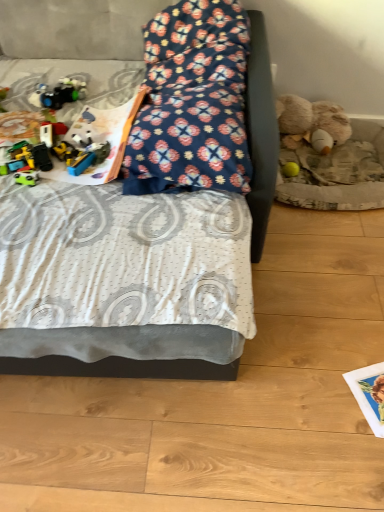
This screenshot has width=384, height=512. Describe the element at coordinates (58, 93) in the screenshot. I see `shiny plastic toy car at left, which is the third toy in right-to-left order` at that location.

Describe the element at coordinates (260, 133) in the screenshot. Image resolution: width=384 pixels, height=512 pixels. I see `floral fabric bed at center` at that location.

This screenshot has width=384, height=512. I want to click on floral fabric bed at center, so click(x=260, y=133).

Describe the element at coordinates (312, 123) in the screenshot. The height and width of the screenshot is (512, 384). I see `fluffy beige teddy bear at right` at that location.

What do you see at coordinates (26, 177) in the screenshot? I see `matte green toy car at left, which is counted as the third toy, starting from the back` at bounding box center [26, 177].

Describe the element at coordinates (192, 102) in the screenshot. I see `floral fabric pillow at center` at that location.

This screenshot has width=384, height=512. I want to click on yellow rubber ball at lower right, the third toy from the left, so click(290, 169).

Is fluffy beige teddy bear at right beside yellow rubber ball at lower right, the third toy from the left?

No, fluffy beige teddy bear at right is not touching yellow rubber ball at lower right, the third toy from the left.

Is yellow rubber ball at lower right, which is the second toy from bottom to top, at the back of fluffy beige teddy bear at right?

fluffy beige teddy bear at right does not have its back to yellow rubber ball at lower right, which is the second toy from bottom to top.

Does fluffy beige teddy bear at right have a larger size compared to yellow rubber ball at lower right, the third toy from the left?

Yes.

Considering the points (313, 143) and (284, 174), which point is behind, point (313, 143) or point (284, 174)?

Point (313, 143)

Between matte green toy car at left, which is the second toy from left to right, and yellow rubber ball at lower right, the third toy from the front, which one has more height?

Standing taller between the two is yellow rubber ball at lower right, the third toy from the front.

Considering the positions of objects matte green toy car at left, placed as the first toy when sorted from front to back, and yellow rubber ball at lower right, which is the first toy from back to front, in the image provided, who is behind, matte green toy car at left, placed as the first toy when sorted from front to back, or yellow rubber ball at lower right, which is the first toy from back to front,?

yellow rubber ball at lower right, which is the first toy from back to front.

Looking at their sizes, would you say matte green toy car at left, which ranks as the third toy in top-to-bottom order, is wider or thinner than yellow rubber ball at lower right, which is the first toy from back to front?

Clearly, matte green toy car at left, which ranks as the third toy in top-to-bottom order, has more width compared to yellow rubber ball at lower right, which is the first toy from back to front.

From the image's perspective, is matte green toy car at left, placed as the first toy when sorted from front to back, above or below yellow rubber ball at lower right, which is the second toy from bottom to top?

matte green toy car at left, placed as the first toy when sorted from front to back, is below yellow rubber ball at lower right, which is the second toy from bottom to top.

What's the angular difference between floral fabric pillow at center and fluffy beige teddy bear at right's facing directions?

The facing directions of floral fabric pillow at center and fluffy beige teddy bear at right are 1.57 degrees apart.

From the image's perspective, who appears lower, floral fabric pillow at center or fluffy beige teddy bear at right?

floral fabric pillow at center is shown below in the image.

Looking at this image, which object is thinner, floral fabric pillow at center or fluffy beige teddy bear at right?

Thinner between the two is fluffy beige teddy bear at right.

How distant is floral fabric pillow at center from fluffy beige teddy bear at right?

The distance of floral fabric pillow at center from fluffy beige teddy bear at right is 27.81 inches.

Which is correct: floral fabric pillow at center is inside floral fabric bed at center, or outside of it?

The correct answer is: inside.

Considering the positions of objects floral fabric pillow at center and floral fabric bed at center in the image provided, who is behind, floral fabric pillow at center or floral fabric bed at center?

floral fabric pillow at center.

From a real-world perspective, is floral fabric pillow at center physically located above or below floral fabric bed at center?

In terms of real-world spatial position, floral fabric pillow at center is above floral fabric bed at center.

Considering the relative sizes of yellow rubber ball at lower right, the third toy from the left, and floral fabric pillow at center in the image provided, is yellow rubber ball at lower right, the third toy from the left, thinner than floral fabric pillow at center?

Correct, the width of yellow rubber ball at lower right, the third toy from the left, is less than that of floral fabric pillow at center.

Which is nearer, (285, 170) or (153, 47)?

Point (153, 47)

Which object is further away from the camera taking this photo, yellow rubber ball at lower right, the third toy from the left, or floral fabric pillow at center?

yellow rubber ball at lower right, the third toy from the left, is further from the camera.

In the scene shown: Considering the relative sizes of yellow rubber ball at lower right, the third toy from the left, and floral fabric pillow at center in the image provided, is yellow rubber ball at lower right, the third toy from the left, shorter than floral fabric pillow at center?

Yes.

Considering the sizes of objects yellow rubber ball at lower right, the third toy from the front, and fluffy beige teddy bear at right in the image provided, who is bigger, yellow rubber ball at lower right, the third toy from the front, or fluffy beige teddy bear at right?

With larger size is fluffy beige teddy bear at right.

Is point (285, 167) positioned behind point (290, 98)?

No.

Can you confirm if yellow rubber ball at lower right, which is the first toy from back to front, is positioned to the right of fluffy beige teddy bear at right?

In fact, yellow rubber ball at lower right, which is the first toy from back to front, is to the left of fluffy beige teddy bear at right.

Is yellow rubber ball at lower right, the first toy viewed from the right, positioned with its back to fluffy beige teddy bear at right?

Yes, yellow rubber ball at lower right, the first toy viewed from the right, is positioned with its back facing fluffy beige teddy bear at right.

Is the position of shiny plastic toy car at left, marked as the 3th toy in a bottom-to-top arrangement, less distant than that of floral fabric pillow at center?

No.

Is shiny plastic toy car at left, arranged as the 1th toy when viewed from the top, turned away from floral fabric pillow at center?

shiny plastic toy car at left, arranged as the 1th toy when viewed from the top, does not have its back to floral fabric pillow at center.

Considering the sizes of objects shiny plastic toy car at left, the 2th toy in the front-to-back sequence, and floral fabric pillow at center in the image provided, who is taller, shiny plastic toy car at left, the 2th toy in the front-to-back sequence, or floral fabric pillow at center?

floral fabric pillow at center.

You are a GUI agent. You are given a task and a screenshot of the screen. Output one action in this format:
    pyautogui.click(x=<x>, y=<y>)
    Task: Click on the teddy bear located above the yellow rubber ball at lower right, the second toy viewed from the top (from the image's perspective)
    The image size is (384, 512).
    Given the screenshot: What is the action you would take?
    pos(312,123)

Where is `toy below the yellow rubber ball at lower right, the third toy from the front (from the image's perspective)`? toy below the yellow rubber ball at lower right, the third toy from the front (from the image's perspective) is located at coordinates (26, 177).

Looking at the image, which one is located closer to yellow rubber ball at lower right, the first toy viewed from the right, shiny plastic toy car at left, which is the third toy in right-to-left order, or floral fabric pillow at center?

floral fabric pillow at center is positioned closer to the anchor yellow rubber ball at lower right, the first toy viewed from the right.

Looking at the image, which one is located closer to floral fabric pillow at center, matte green toy car at left, which is counted as the third toy, starting from the back, or yellow rubber ball at lower right, the second toy viewed from the top?

matte green toy car at left, which is counted as the third toy, starting from the back, lies closer to floral fabric pillow at center than the other object.

From the image, which object appears to be nearer to floral fabric bed at center, matte green toy car at left, which is counted as the third toy, starting from the back, or shiny plastic toy car at left, arranged as the 1th toy when viewed from the top?

Based on the image, matte green toy car at left, which is counted as the third toy, starting from the back, appears to be nearer to floral fabric bed at center.

Based on their spatial positions, is matte green toy car at left, placed as the first toy when sorted from front to back, or floral fabric bed at center closer to fluffy beige teddy bear at right?

The object closer to fluffy beige teddy bear at right is floral fabric bed at center.

Looking at the image, which one is located closer to fluffy beige teddy bear at right, floral fabric bed at center or floral fabric pillow at center?

floral fabric pillow at center lies closer to fluffy beige teddy bear at right than the other object.

Considering their positions, is matte green toy car at left, placed as the first toy when sorted from front to back, positioned closer to fluffy beige teddy bear at right than yellow rubber ball at lower right, the third toy from the left?

yellow rubber ball at lower right, the third toy from the left, is positioned closer to the anchor fluffy beige teddy bear at right.

Looking at the image, which one is located further to floral fabric pillow at center, floral fabric bed at center or shiny plastic toy car at left, marked as the 3th toy in a bottom-to-top arrangement?

floral fabric bed at center lies further to floral fabric pillow at center than the other object.

Looking at the image, which one is located closer to floral fabric bed at center, yellow rubber ball at lower right, the first toy viewed from the right, or fluffy beige teddy bear at right?

Based on the image, yellow rubber ball at lower right, the first toy viewed from the right, appears to be nearer to floral fabric bed at center.

This screenshot has height=512, width=384. I want to click on pillow between floral fabric bed at center and fluffy beige teddy bear at right in the front-back direction, so click(x=192, y=102).

This screenshot has width=384, height=512. I want to click on pillow between shiny plastic toy car at left, the 1th toy from the left, and yellow rubber ball at lower right, which is the first toy from back to front, in the horizontal direction, so click(192, 102).

The width and height of the screenshot is (384, 512). Identify the location of pillow situated between shiny plastic toy car at left, marked as the second toy in a back-to-front arrangement, and fluffy beige teddy bear at right from left to right. (192, 102).

Locate an element on the screen. toy between shiny plastic toy car at left, marked as the second toy in a back-to-front arrangement, and yellow rubber ball at lower right, the second toy viewed from the top, from left to right is located at coordinates (26, 177).